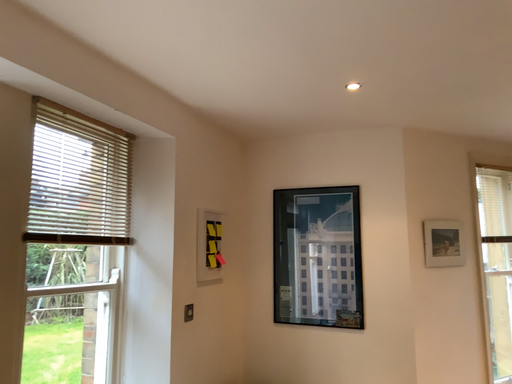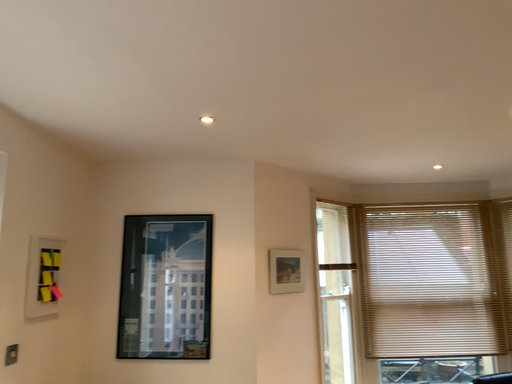
Question: Which way did the camera rotate in the video?

Choices:
 (A) rotated left
 (B) rotated right

Answer: (B)